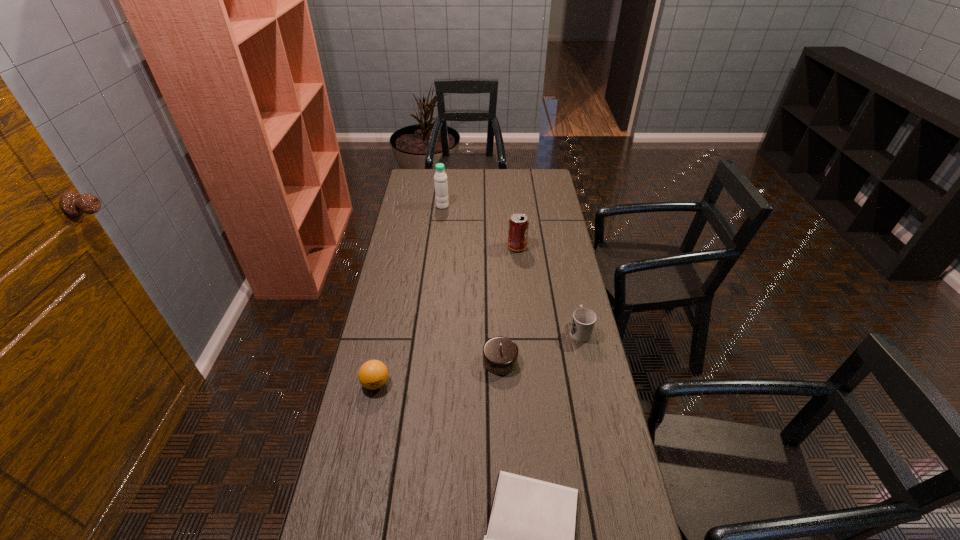
The height and width of the screenshot is (540, 960). I want to click on vacant space at the far left corner of the desktop, so click(417, 191).

Identify the location of vacant space at the far right corner. (545, 183).

Find the location of a particular element. The image size is (960, 540). free spot between the soda can and the cup is located at coordinates (548, 288).

I want to click on empty location between the leftmost object and the fifth object from right to left, so click(x=409, y=295).

Locate an element on the screen. vacant space that's between the cup and the water bottle is located at coordinates (512, 268).

Locate an element on the screen. vacant space that is in between the second object from left to right and the second farthest object is located at coordinates (480, 226).

You are a GUI agent. You are given a task and a screenshot of the screen. Output one action in this format:
    pyautogui.click(x=<x>, y=<y>)
    Task: Click on the empty location between the rightmost object and the leftmost object
    This screenshot has height=540, width=960.
    Given the screenshot: What is the action you would take?
    pyautogui.click(x=478, y=357)

Where is `free space between the soda can and the ping-pong ball`? This screenshot has height=540, width=960. free space between the soda can and the ping-pong ball is located at coordinates (446, 315).

At what (x,y) coordinates should I click in order to perform the action: click on unoccupied position between the cup and the fifth shortest object. Please return your answer as a coordinate pair (x, y). This screenshot has width=960, height=540. Looking at the image, I should click on (548, 288).

Locate which object is the closest to the hardback book. Please provide its 2D coordinates. Your answer should be formatted as a tuple, i.e. [(x, y)], where the tuple contains the x and y coordinates of a point satisfying the conditions above.

[(500, 354)]